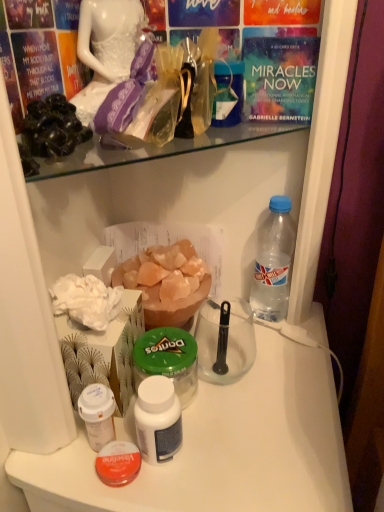
Locate an element on the screen. The width and height of the screenshot is (384, 512). vacant area that is in front of green plastic jar at center, which ranks as the third bottle in left-to-right order is located at coordinates (181, 475).